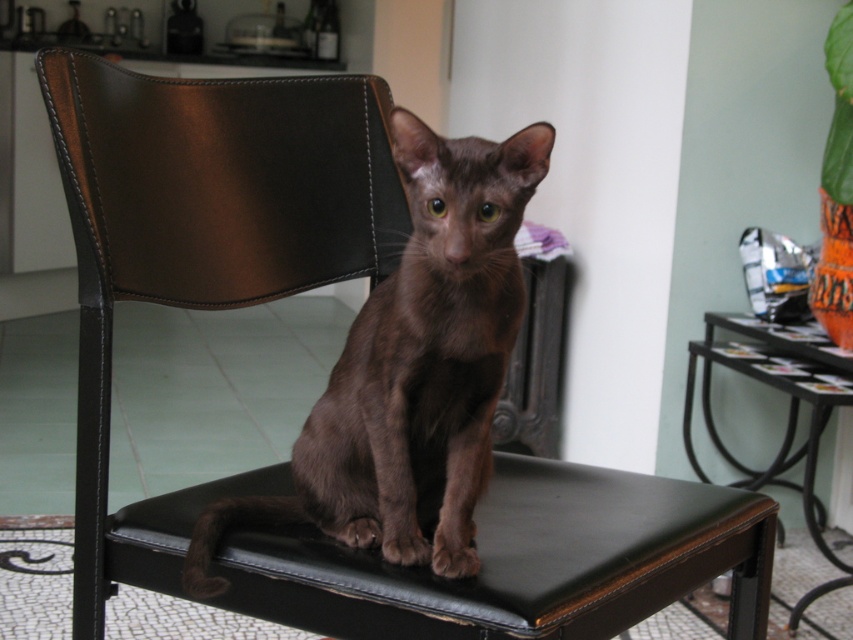
You are standing in the room and see two points labeled as point [749,570] and point [227,524]. Which point is closer to you?

Point [749,570] is closer to you because it is further to the viewer than point [227,524].

You are a person who is 160 cm tall. You want to sit on the black leather stool at center to reach the kitchen counter which is at the same height as the brown matte cat at center. Can you sit comfortably on the stool?

The black leather stool at center is not as tall as brown matte cat at center, so the stool is shorter than the cat. Since the kitchen counter is at the same height as the cat, the stool is too short for you to reach the counter comfortably when sitting on it.

You are a delivery person who needs to place a small package on the black leather stool at center. Can you confirm the exact coordinates where you should place it?

The black leather stool at center is located at coordinates point (521, 561), so place the package there.